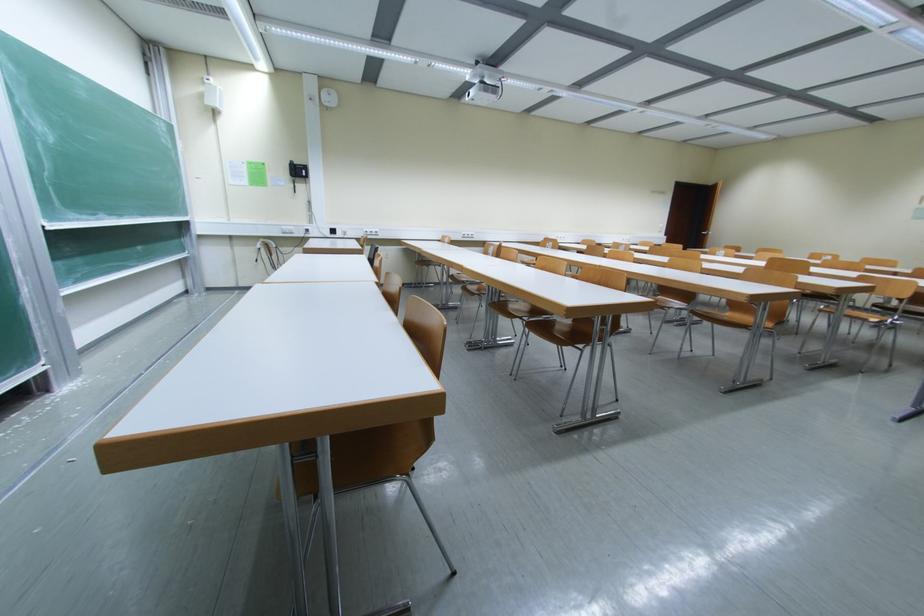
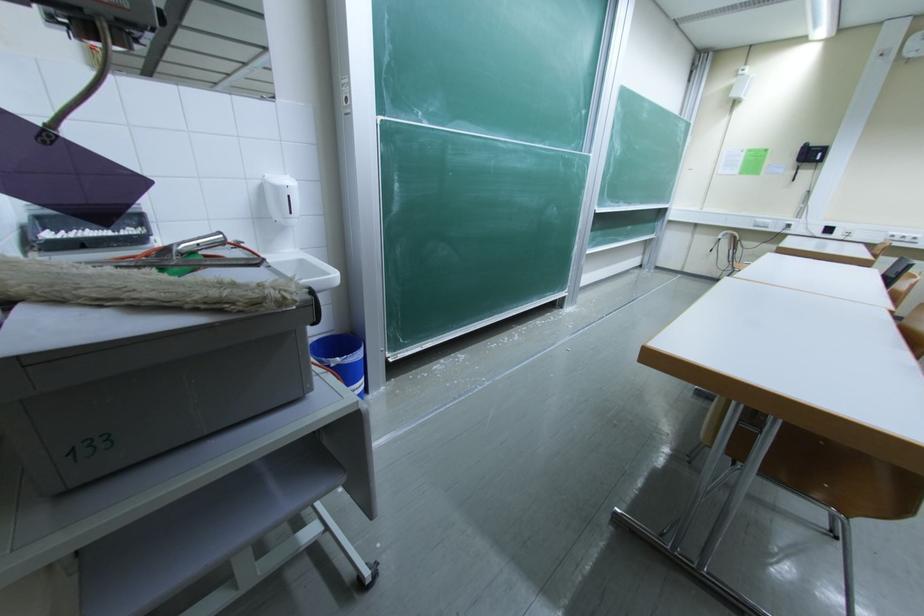
Question: How did the camera likely rotate?

Choices:
 (A) Left
 (B) Right
 (C) Up
 (D) Down

Answer: (A)